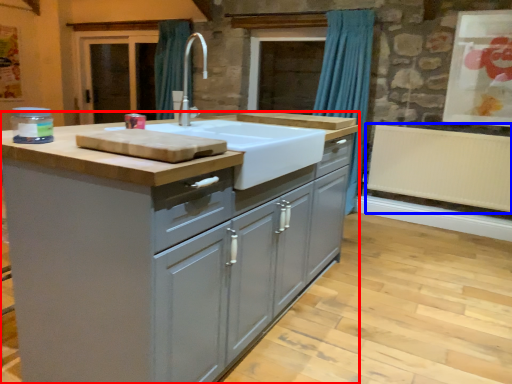
Question: Which point is further to the camera, cabinetry (highlighted by a red box) or radiator (highlighted by a blue box)?

Choices:
 (A) cabinetry
 (B) radiator

Answer: (B)